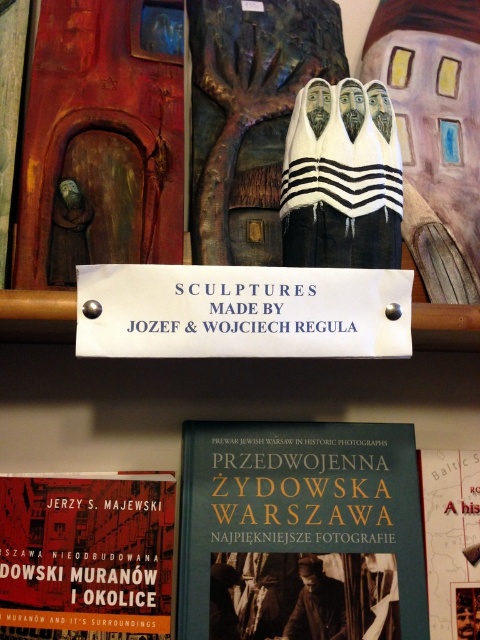
Question: Which of the following is the closest to the observer?

Choices:
 (A) matte red book at lower left
 (B) matte paper book at center

Answer: (A)

Question: Considering the relative positions of matte red book at lower left and matte paper book at center in the image provided, where is matte red book at lower left located with respect to matte paper book at center?

Choices:
 (A) above
 (B) below

Answer: (A)

Question: Is hardcover book at center to the left of matte paper book at center from the viewer's perspective?

Choices:
 (A) no
 (B) yes

Answer: (B)

Question: Which of the following is the farthest from the observer?

Choices:
 (A) hardcover book at center
 (B) matte paper book at center
 (C) matte red book at lower left

Answer: (B)

Question: Among these objects, which one is nearest to the camera?

Choices:
 (A) matte red book at lower left
 (B) matte paper book at center
 (C) hardcover book at center

Answer: (A)

Question: Can you confirm if matte red book at lower left is thinner than matte paper book at center?

Choices:
 (A) no
 (B) yes

Answer: (A)